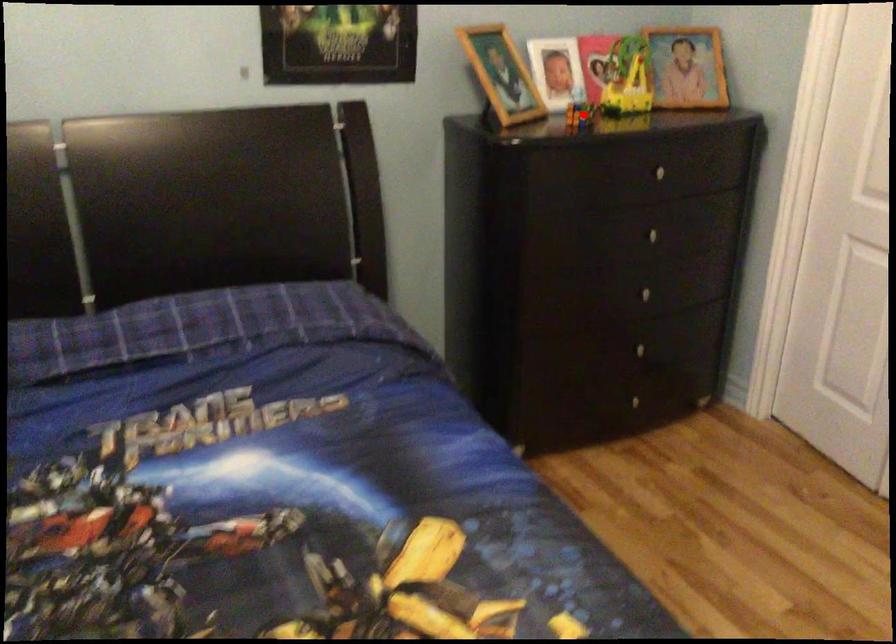
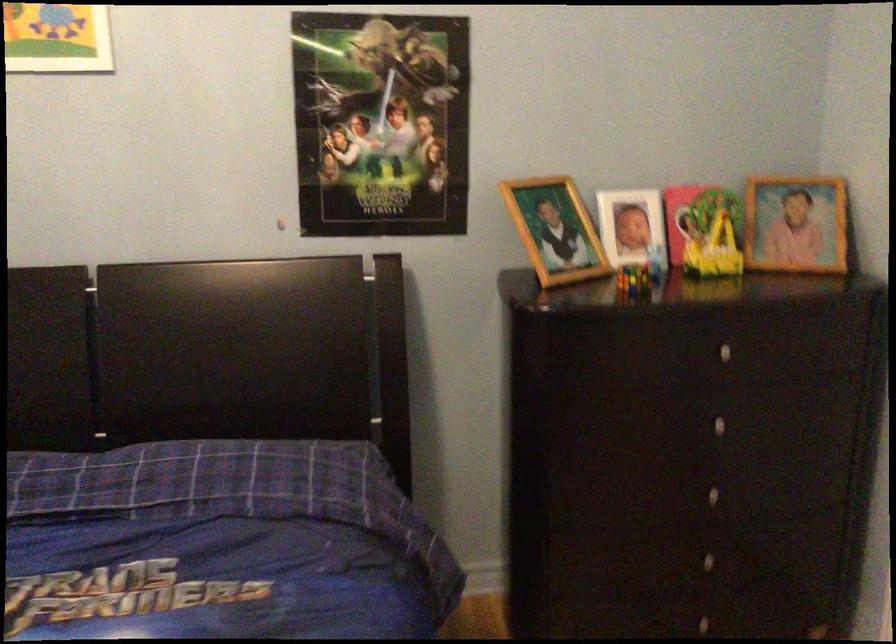
Question: I am providing you with two images of the same scene from different viewpoints. Image1 has a red point marked. In image2, the corresponding 3D location appears at what relative position? Reply with the corresponding letter.

Choices:
 (A) Closer
 (B) Farther

Answer: (A)